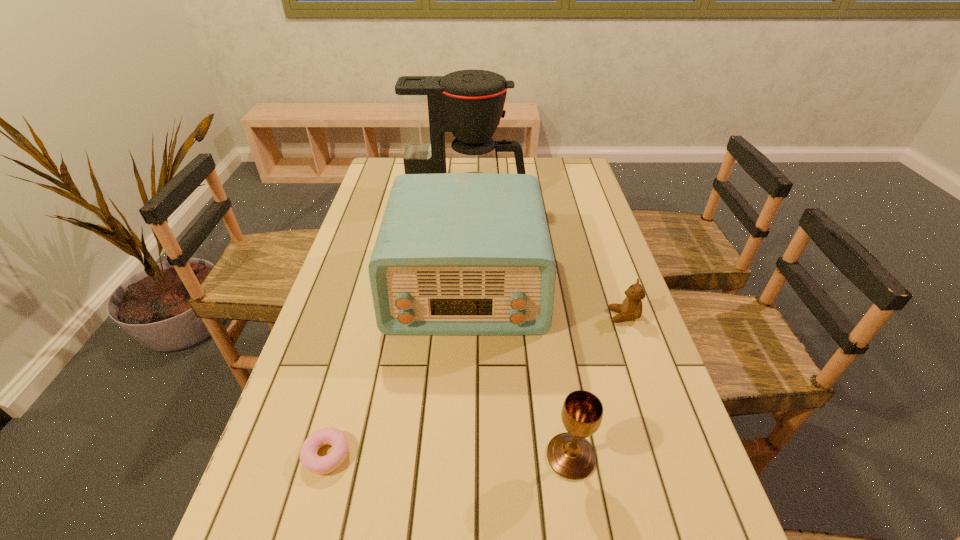
Locate an element on the screen. The image size is (960, 540). vacant space situated 0.290m on the back of the chalice is located at coordinates (550, 326).

What are the coordinates of `vacant space located on the front-facing side of the teddy bear` in the screenshot? It's located at (535, 316).

Find the location of a particular element. This screenshot has height=540, width=960. blank area located 0.330m on the front-facing side of the teddy bear is located at coordinates (480, 316).

Image resolution: width=960 pixels, height=540 pixels. Identify the location of blank space located on the front-facing side of the teddy bear. (574, 316).

Locate an element on the screen. The height and width of the screenshot is (540, 960). vacant space located 0.100m on the front of the leftmost object is located at coordinates (304, 538).

Where is `object that is at the far edge`? object that is at the far edge is located at coordinates (469, 103).

Locate an element on the screen. This screenshot has width=960, height=540. coffee maker located in the left edge section of the desktop is located at coordinates (469, 103).

Where is `radio receiver that is at the left edge`? The height and width of the screenshot is (540, 960). radio receiver that is at the left edge is located at coordinates (457, 254).

Where is `doughnut located at the left edge`? doughnut located at the left edge is located at coordinates (321, 465).

In order to click on object that is at the right edge in this screenshot , I will do `click(631, 308)`.